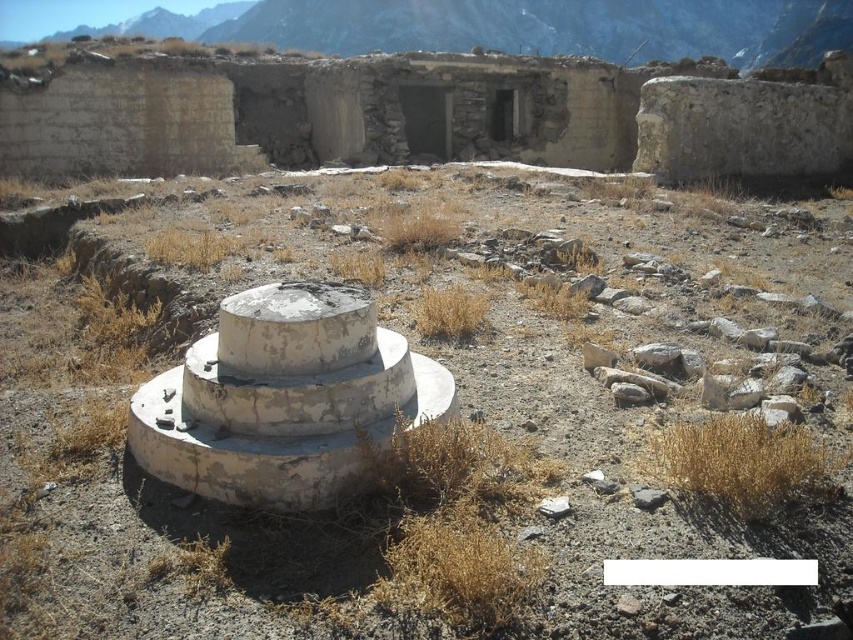
You are standing at point (282,397) in this desolate, arid landscape. What do you see immediately around you?

You see a white weathered concrete structure at center immediately around you at point (282,397).